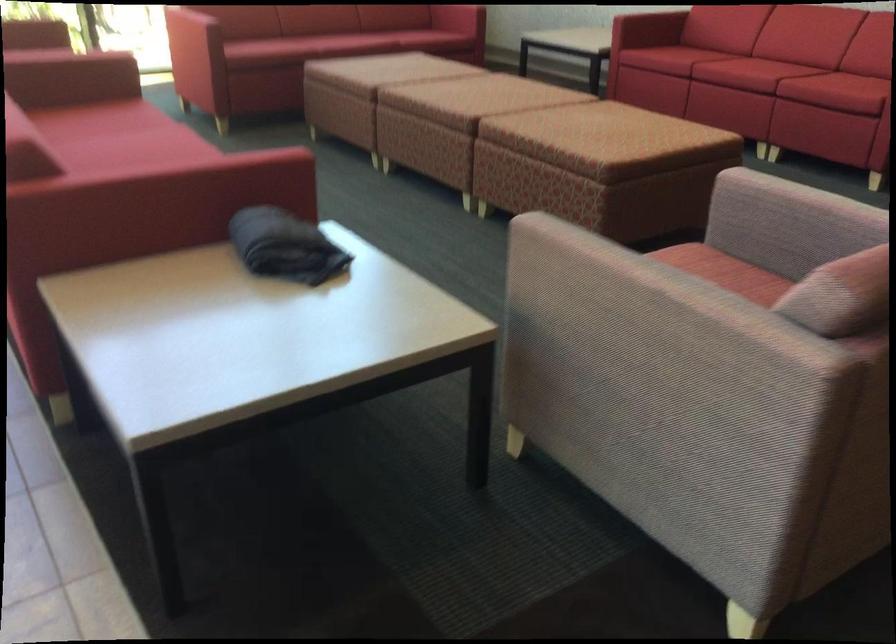
The image size is (896, 644). What do you see at coordinates (299, 44) in the screenshot?
I see `the red chair sitting surface` at bounding box center [299, 44].